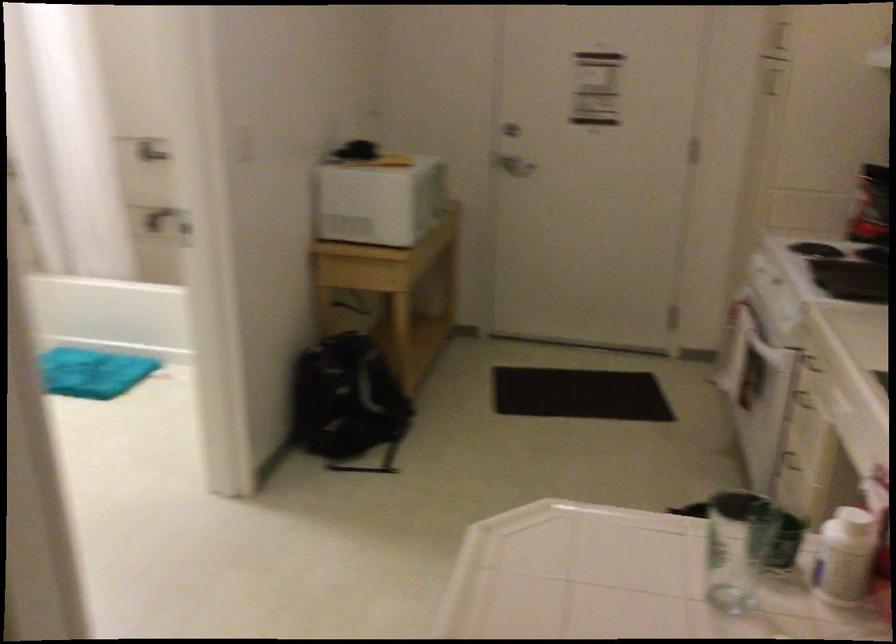
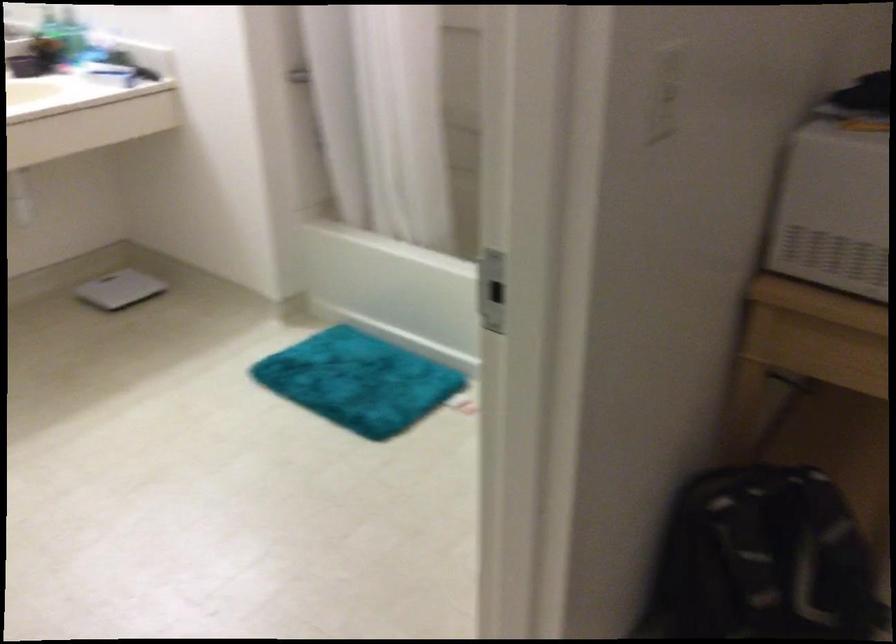
Locate, in the second image, the point that corresponds to [83,372] in the first image.

(358, 381)